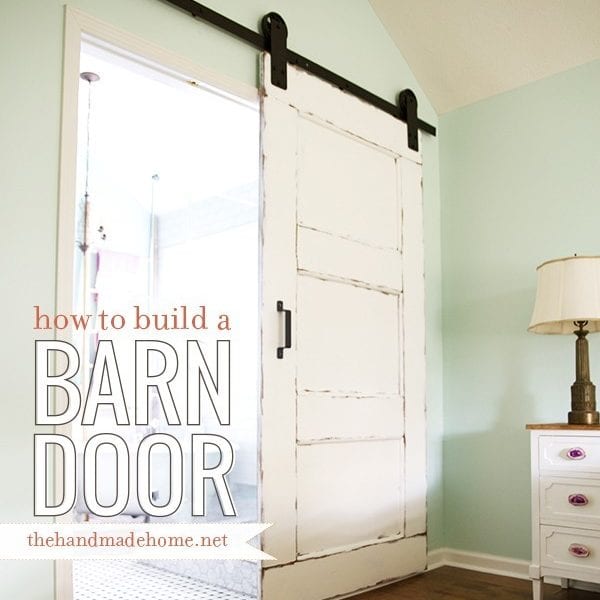
This screenshot has width=600, height=600. I want to click on door handle, so click(x=284, y=337).